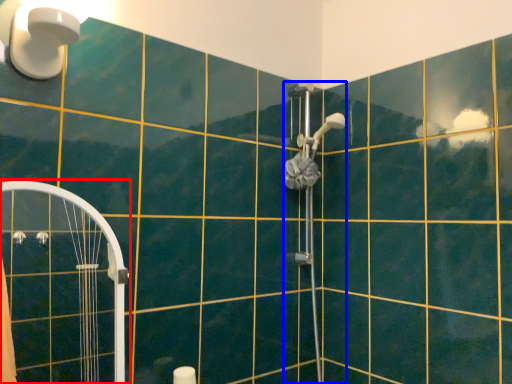
Question: Among these objects, which one is farthest to the camera, shower door (highlighted by a red box) or shower (highlighted by a blue box)?

Choices:
 (A) shower door
 (B) shower

Answer: (B)